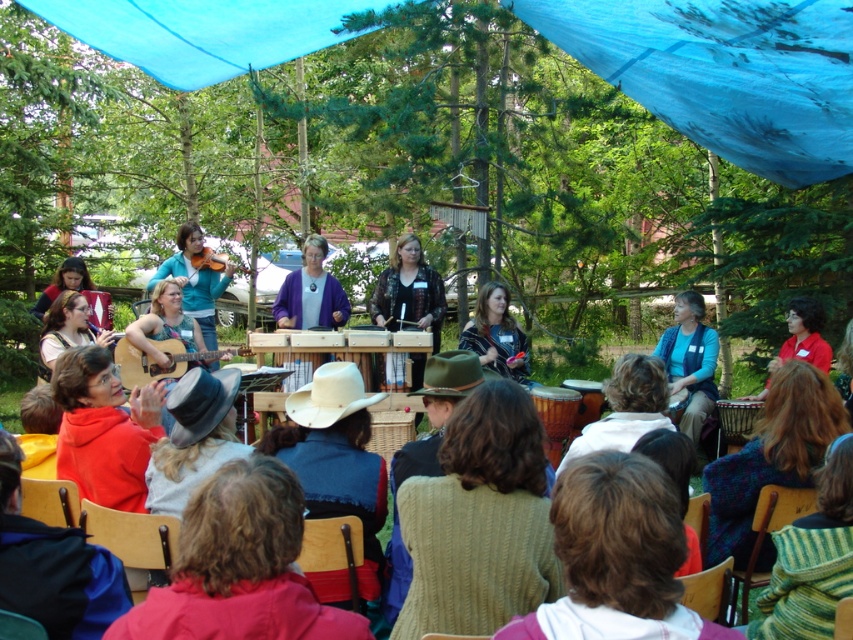
Question: Among these points, which one is farthest from the camera?

Choices:
 (A) (165, 337)
 (B) (654, 388)
 (C) (294, 397)
 (D) (498, 342)

Answer: (D)

Question: Is knitted sweater at lower right bigger than blue fabric at center?

Choices:
 (A) yes
 (B) no

Answer: (B)

Question: Is knitted sweater at center positioned before green felt cowboy hat at center?

Choices:
 (A) no
 (B) yes

Answer: (A)

Question: Where is red woolen jacket at lower center located in relation to red fabric shirt at center in the image?

Choices:
 (A) above
 (B) below

Answer: (B)

Question: Which point is closer to the camera?

Choices:
 (A) knitted green sweater at lower center
 (B) red woolen jacket at lower center
 (C) red sweater at lower left
 (D) matte black flute at left

Answer: (A)

Question: Which object is farther from the camera taking this photo?

Choices:
 (A) matte blue guitar at center
 (B) red woolen jacket at lower center

Answer: (A)